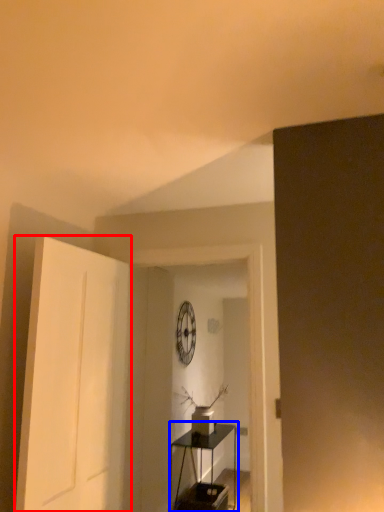
Question: Which object is closer to the camera taking this photo, door (highlighted by a red box) or table (highlighted by a blue box)?

Choices:
 (A) door
 (B) table

Answer: (A)